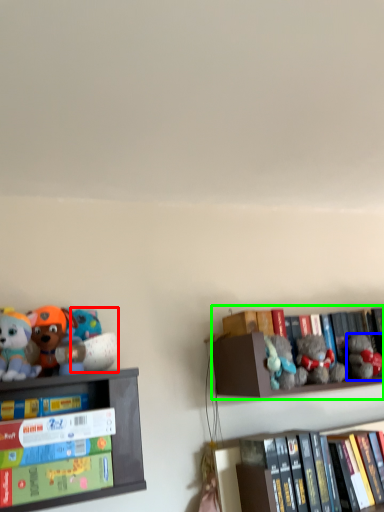
Question: Based on their relative distances, which object is farther from toy (highlighted by a red box)? Choose from toy (highlighted by a blue box) and shelf (highlighted by a green box).

Choices:
 (A) toy
 (B) shelf

Answer: (A)